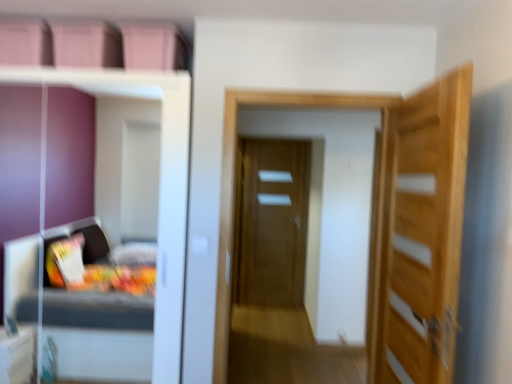
Question: Does transparent glass door at center appear on the right side of light wood door at right, which is counted as the second door, starting from the left?

Choices:
 (A) yes
 (B) no

Answer: (B)

Question: From the image's perspective, is transparent glass door at center located above light wood door at right, which is counted as the second door, starting from the back?

Choices:
 (A) yes
 (B) no

Answer: (A)

Question: Is transparent glass door at center positioned behind light wood door at right, the 1th door from the front?

Choices:
 (A) no
 (B) yes

Answer: (B)

Question: Can you see transparent glass door at center touching light wood door at right, which is counted as the second door, starting from the left?

Choices:
 (A) no
 (B) yes

Answer: (A)

Question: From a real-world perspective, is transparent glass door at center physically below light wood door at right, arranged as the 1th door when viewed from the right?

Choices:
 (A) no
 (B) yes

Answer: (B)

Question: Can you confirm if transparent glass door at center is bigger than light wood door at right, which is counted as the second door, starting from the back?

Choices:
 (A) no
 (B) yes

Answer: (B)

Question: Considering the relative positions of matte wooden door at center, which ranks as the second door in right-to-left order, and transparent glass door at center in the image provided, is matte wooden door at center, which ranks as the second door in right-to-left order, to the right of transparent glass door at center from the viewer's perspective?

Choices:
 (A) no
 (B) yes

Answer: (A)

Question: Is matte wooden door at center, the 1th door positioned from the back, taller than transparent glass door at center?

Choices:
 (A) no
 (B) yes

Answer: (B)

Question: Considering the relative positions of matte wooden door at center, arranged as the first door when viewed from the left, and transparent glass door at center in the image provided, is matte wooden door at center, arranged as the first door when viewed from the left, in front of transparent glass door at center?

Choices:
 (A) yes
 (B) no

Answer: (B)

Question: Is the depth of matte wooden door at center, arranged as the first door when viewed from the left, greater than that of transparent glass door at center?

Choices:
 (A) yes
 (B) no

Answer: (A)

Question: Considering the relative sizes of matte wooden door at center, which ranks as the second door in right-to-left order, and transparent glass door at center in the image provided, is matte wooden door at center, which ranks as the second door in right-to-left order, bigger than transparent glass door at center?

Choices:
 (A) yes
 (B) no

Answer: (B)

Question: From a real-world perspective, is matte wooden door at center, which ranks as the second door in right-to-left order, under transparent glass door at center?

Choices:
 (A) no
 (B) yes

Answer: (B)

Question: Is light wood door at right, the 1th door from the front, wider than transparent glass door at center?

Choices:
 (A) no
 (B) yes

Answer: (A)